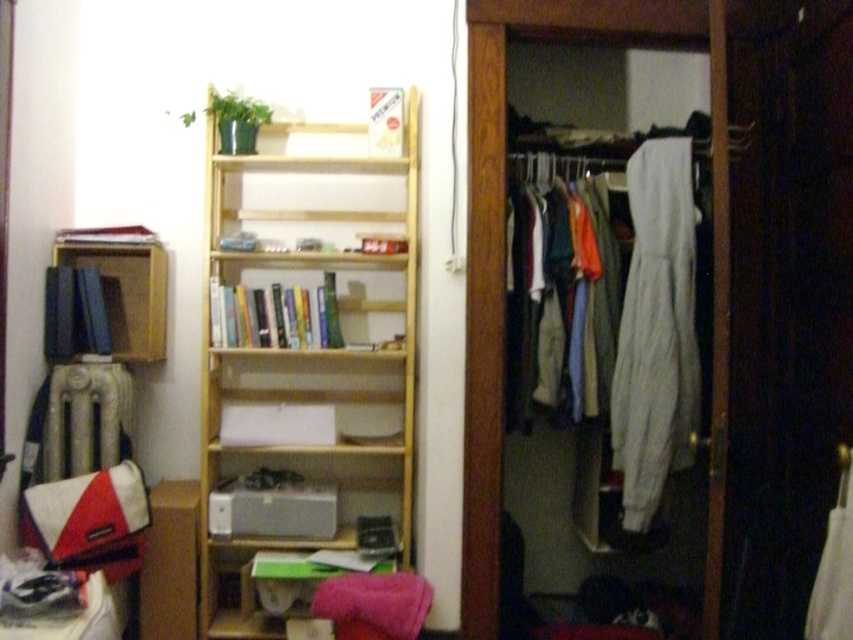
Question: Can you confirm if light wood/bookshelf at center is thinner than matte wood bookshelf at left?

Choices:
 (A) yes
 (B) no

Answer: (B)

Question: Estimate the real-world distances between objects in this image. Which object is farther from the white fleece sweatpants at center?

Choices:
 (A) light wood/bookshelf at center
 (B) white fabric at center
 (C) matte wood bookshelf at left
 (D) white cotton hoodie at center

Answer: (C)

Question: Among these points, which one is nearest to the camera?

Choices:
 (A) (618, 330)
 (B) (664, 381)
 (C) (212, 428)

Answer: (B)

Question: Which point appears closest to the camera in this image?

Choices:
 (A) (341, 522)
 (B) (645, 412)

Answer: (B)

Question: Observing the image, what is the correct spatial positioning of light wood/bookshelf at center in reference to matte wood bookshelf at left?

Choices:
 (A) left
 (B) right

Answer: (B)

Question: Can you confirm if light wood/bookshelf at center is positioned above white fleece sweatpants at center?

Choices:
 (A) no
 (B) yes

Answer: (A)